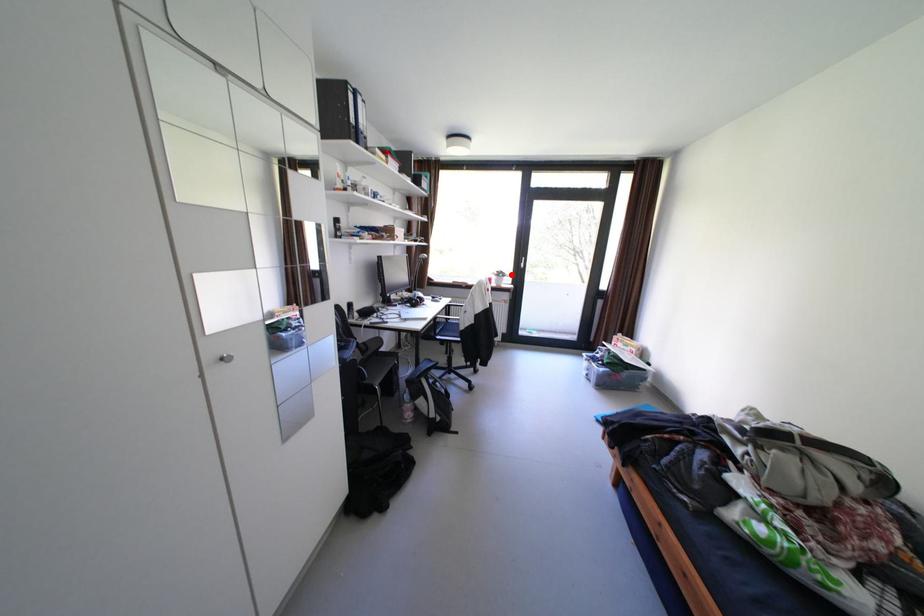
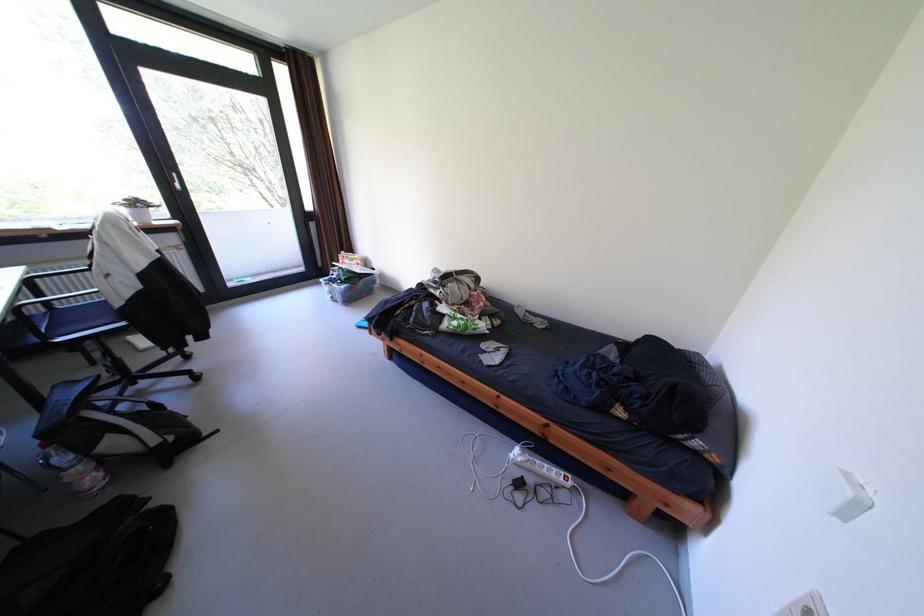
Question: I am providing you with two images of the same scene from different viewpoints. In image1, a red point is highlighted. Considering the same 3D point in image2, which of the following is correct?

Choices:
 (A) It is closer
 (B) It is farther

Answer: (B)